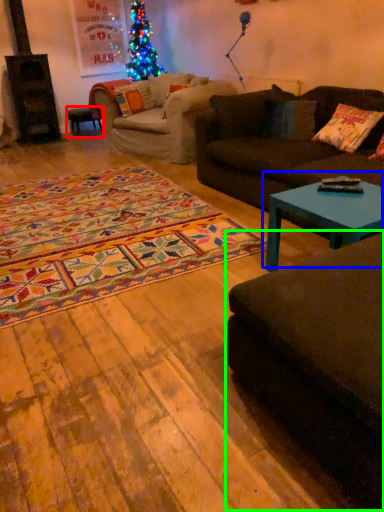
Question: Based on their relative distances, which object is farther from stool (highlighted by a red box)? Choose from coffee table (highlighted by a blue box) and studio couch (highlighted by a green box).

Choices:
 (A) coffee table
 (B) studio couch

Answer: (B)